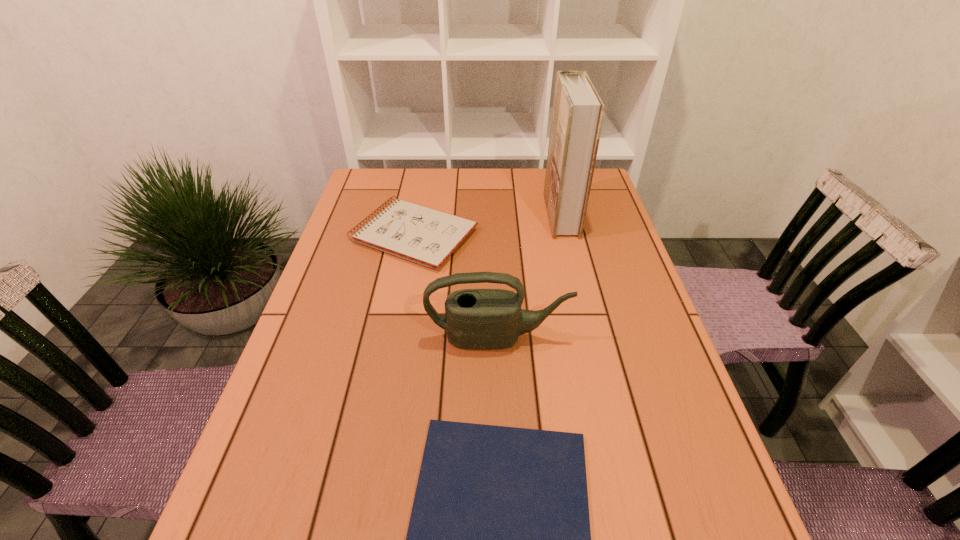
Where is `vacant space that satisfies the following two spatial constraints: 1. on the cover of the rightmost object; 2. on the front side of the third tallest object`? This screenshot has width=960, height=540. vacant space that satisfies the following two spatial constraints: 1. on the cover of the rightmost object; 2. on the front side of the third tallest object is located at coordinates (566, 235).